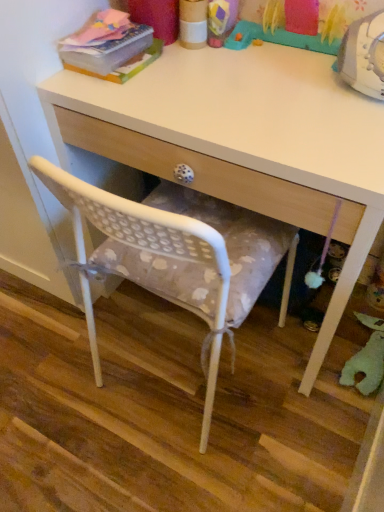
The width and height of the screenshot is (384, 512). In order to click on white fabric cushion at center in this screenshot , I will do `click(168, 411)`.

Image resolution: width=384 pixels, height=512 pixels. Describe the element at coordinates (168, 411) in the screenshot. I see `white fabric cushion at center` at that location.

The image size is (384, 512). Identify the location of matte pink book at upper left. (110, 47).

The height and width of the screenshot is (512, 384). Describe the element at coordinates (366, 358) in the screenshot. I see `green felt toy at lower right, marked as the 1th toy in a back-to-front arrangement` at that location.

Identify the location of plastic toy at upper center, which appears as the second toy when ordered from the bottom. (279, 38).

Find the location of a particular element. Image resolution: width=384 pixels, height=512 pixels. white wood desk at center is located at coordinates (243, 142).

Identify the location of white fabric cushion at center. (168, 411).

In terms of width, does plastic toy at upper center, the 1th toy viewed from the left, look wider or thinner when compared to white wood desk at center?

In the image, plastic toy at upper center, the 1th toy viewed from the left, appears to be more narrow than white wood desk at center.

Based on the photo, does plastic toy at upper center, the first toy viewed from the top, appear on the right side of white wood desk at center?

Yes.

From a real-world perspective, does plastic toy at upper center, which appears as the second toy when ordered from the bottom, stand above white wood desk at center?

Yes, from a real-world perspective, plastic toy at upper center, which appears as the second toy when ordered from the bottom, is over white wood desk at center

Is plastic toy at upper center, the second toy from the right, completely or partially outside of white wood desk at center?

plastic toy at upper center, the second toy from the right, is positioned outside white wood desk at center.

Considering the positions of objects white fabric cushion at center and matte pink book at upper left in the image provided, who is more to the right, white fabric cushion at center or matte pink book at upper left?

From the viewer's perspective, white fabric cushion at center appears more on the right side.

Is white fabric cushion at center aimed at matte pink book at upper left?

No, white fabric cushion at center does not turn towards matte pink book at upper left.

Which of these two, white fabric cushion at center or matte pink book at upper left, is smaller?

matte pink book at upper left is smaller.

From a real-world perspective, which is physically above, white fabric cushion at center or matte pink book at upper left?

matte pink book at upper left.

Does green felt toy at lower right, which is the 2th toy in left-to-right order, have a greater width compared to white fabric cushion at center?

No.

Consider the image. Is green felt toy at lower right, placed as the second toy when sorted from front to back, looking in the opposite direction of white fabric cushion at center?

No, green felt toy at lower right, placed as the second toy when sorted from front to back, is not facing the opposite direction of white fabric cushion at center.

From a real-world perspective, is green felt toy at lower right, marked as the 1th toy in a back-to-front arrangement, on white fabric cushion at center?

Yes, from a real-world perspective, green felt toy at lower right, marked as the 1th toy in a back-to-front arrangement, is over white fabric cushion at center

Can you confirm if green felt toy at lower right, marked as the first toy in a right-to-left arrangement, is taller than white fabric cushion at center?

Yes.

In the scene shown: In terms of height, does plastic toy at upper center, the first toy viewed from the top, look taller or shorter compared to green felt toy at lower right, placed as the second toy when sorted from front to back?

Considering their sizes, plastic toy at upper center, the first toy viewed from the top, has more height than green felt toy at lower right, placed as the second toy when sorted from front to back.

Looking at this image, are plastic toy at upper center, which appears as the second toy when ordered from the bottom, and green felt toy at lower right, marked as the 1th toy in a back-to-front arrangement, far apart?

plastic toy at upper center, which appears as the second toy when ordered from the bottom, is near green felt toy at lower right, marked as the 1th toy in a back-to-front arrangement, not far away.

In the scene shown: Measure the distance between plastic toy at upper center, which ranks as the second toy in back-to-front order, and green felt toy at lower right, marked as the 1th toy in a back-to-front arrangement.

They are 32.09 inches apart.

Locate an element on the screen. This screenshot has height=512, width=384. toy to the right of plastic toy at upper center, which ranks as the second toy in back-to-front order is located at coordinates (366, 358).

Relative to matte pink book at upper left, is white wood desk at center in front or behind?

white wood desk at center is positioned closer to the viewer than matte pink book at upper left.

In terms of size, does white wood desk at center appear bigger or smaller than matte pink book at upper left?

white wood desk at center is bigger than matte pink book at upper left.

In the scene shown: Between white wood desk at center and matte pink book at upper left, which one has smaller width?

With smaller width is matte pink book at upper left.

Can you confirm if green felt toy at lower right, marked as the 1th toy in a back-to-front arrangement, is smaller than matte pink book at upper left?

Actually, green felt toy at lower right, marked as the 1th toy in a back-to-front arrangement, might be larger than matte pink book at upper left.

In the scene shown: From a real-world perspective, between green felt toy at lower right, which is the 2th toy in left-to-right order, and matte pink book at upper left, who is vertically higher?

In real-world perspective, matte pink book at upper left is above.

Is green felt toy at lower right, placed as the 2th toy when sorted from top to bottom, far away from matte pink book at upper left?

Actually, green felt toy at lower right, placed as the 2th toy when sorted from top to bottom, and matte pink book at upper left are a little close together.

What's the angular difference between green felt toy at lower right, which is the 2th toy in left-to-right order, and matte pink book at upper left's facing directions?

The angle between the facing direction of green felt toy at lower right, which is the 2th toy in left-to-right order, and the facing direction of matte pink book at upper left is 12.2 degrees.

Considering the positions of objects green felt toy at lower right, which is the 2th toy in left-to-right order, and white wood desk at center in the image provided, who is more to the left, green felt toy at lower right, which is the 2th toy in left-to-right order, or white wood desk at center?

Positioned to the left is white wood desk at center.

Is green felt toy at lower right, the 1th toy when ordered from bottom to top, aimed at white wood desk at center?

No, green felt toy at lower right, the 1th toy when ordered from bottom to top, does not turn towards white wood desk at center.

Which object is closer to the camera, green felt toy at lower right, which is the 2th toy in left-to-right order, or white wood desk at center?

white wood desk at center is more forward.

Is green felt toy at lower right, the 1th toy when ordered from bottom to top, not close to white wood desk at center?

No, there isn't a large distance between green felt toy at lower right, the 1th toy when ordered from bottom to top, and white wood desk at center.

Which toy is the 1st one when counting from the right side of the white wood desk at center? Please provide its 2D coordinates.

[(279, 38)]

I want to click on book located above the white fabric cushion at center (from a real-world perspective), so click(x=110, y=47).

Considering their positions, is matte pink book at upper left positioned further to white wood desk at center than green felt toy at lower right, which is the 2th toy in left-to-right order?

green felt toy at lower right, which is the 2th toy in left-to-right order, lies further to white wood desk at center than the other object.

Based on their spatial positions, is green felt toy at lower right, marked as the first toy in a right-to-left arrangement, or white fabric cushion at center further from white wood desk at center?

Among the two, green felt toy at lower right, marked as the first toy in a right-to-left arrangement, is located further to white wood desk at center.

Considering their positions, is white fabric cushion at center positioned closer to green felt toy at lower right, marked as the first toy in a right-to-left arrangement, than matte pink book at upper left?

The object closer to green felt toy at lower right, marked as the first toy in a right-to-left arrangement, is white fabric cushion at center.

From the image, which object appears to be nearer to white wood desk at center, green felt toy at lower right, marked as the 1th toy in a back-to-front arrangement, or plastic toy at upper center, which ranks as the second toy in back-to-front order?

plastic toy at upper center, which ranks as the second toy in back-to-front order.

Looking at the image, which one is located closer to matte pink book at upper left, white wood desk at center or green felt toy at lower right, marked as the 1th toy in a back-to-front arrangement?

Among the two, white wood desk at center is located nearer to matte pink book at upper left.

Based on their spatial positions, is white fabric cushion at center or white wood desk at center closer to matte pink book at upper left?

Based on the image, white wood desk at center appears to be nearer to matte pink book at upper left.

Which object lies further to the anchor point green felt toy at lower right, marked as the 1th toy in a back-to-front arrangement, white wood desk at center or plastic toy at upper center, which ranks as the second toy in back-to-front order?

The object further to green felt toy at lower right, marked as the 1th toy in a back-to-front arrangement, is plastic toy at upper center, which ranks as the second toy in back-to-front order.

Based on their spatial positions, is white fabric cushion at center or matte pink book at upper left further from plastic toy at upper center, the first toy viewed from the top?

white fabric cushion at center lies further to plastic toy at upper center, the first toy viewed from the top, than the other object.

The height and width of the screenshot is (512, 384). What are the coordinates of `toy between matte pink book at upper left and white fabric cushion at center from top to bottom` in the screenshot? It's located at (366, 358).

Where is `book between plastic toy at upper center, which is counted as the first toy, starting from the front, and white fabric cushion at center, in the vertical direction`? The image size is (384, 512). book between plastic toy at upper center, which is counted as the first toy, starting from the front, and white fabric cushion at center, in the vertical direction is located at coordinates (110, 47).

Identify the location of desk that lies between plastic toy at upper center, the 1th toy viewed from the left, and green felt toy at lower right, marked as the 1th toy in a back-to-front arrangement, from top to bottom. The height and width of the screenshot is (512, 384). (243, 142).

Locate an element on the screen. The image size is (384, 512). book between plastic toy at upper center, which appears as the second toy when ordered from the bottom, and green felt toy at lower right, placed as the 2th toy when sorted from top to bottom, in the vertical direction is located at coordinates (110, 47).